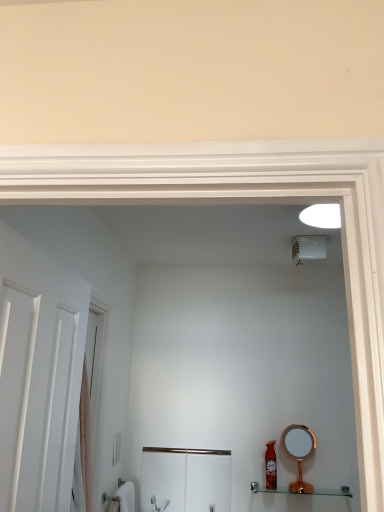
Question: Does brushed metal cabinet at lower center, acting as the first screen door starting from the right, appear on the left side of copper metallic mirror at lower right?

Choices:
 (A) no
 (B) yes

Answer: (B)

Question: Would you say brushed metal cabinet at lower center, which is counted as the first screen door, starting from the back, is outside copper metallic mirror at lower right?

Choices:
 (A) no
 (B) yes

Answer: (B)

Question: From the image's perspective, is brushed metal cabinet at lower center, placed as the 2th screen door when sorted from front to back, located beneath copper metallic mirror at lower right?

Choices:
 (A) no
 (B) yes

Answer: (B)

Question: Is brushed metal cabinet at lower center, the 2th screen door from the left, shorter than copper metallic mirror at lower right?

Choices:
 (A) no
 (B) yes

Answer: (A)

Question: Can you confirm if brushed metal cabinet at lower center, the 2th screen door when ordered from top to bottom, is positioned to the right of copper metallic mirror at lower right?

Choices:
 (A) yes
 (B) no

Answer: (B)

Question: From the image's perspective, is brushed metal cabinet at lower center, the 2th screen door from the left, on copper metallic mirror at lower right?

Choices:
 (A) yes
 (B) no

Answer: (B)

Question: Would you say white matte door at left is part of copper metallic mirror at lower right's contents?

Choices:
 (A) yes
 (B) no

Answer: (B)

Question: Is copper metallic mirror at lower right shorter than white matte door at left?

Choices:
 (A) yes
 (B) no

Answer: (A)

Question: Considering the relative sizes of copper metallic mirror at lower right and white matte door at left in the image provided, is copper metallic mirror at lower right taller than white matte door at left?

Choices:
 (A) yes
 (B) no

Answer: (B)

Question: Is copper metallic mirror at lower right smaller than white matte door at left?

Choices:
 (A) no
 (B) yes

Answer: (B)

Question: Would you say copper metallic mirror at lower right is outside white matte door at left?

Choices:
 (A) no
 (B) yes

Answer: (B)

Question: From the image's perspective, is copper metallic mirror at lower right under white matte door at left?

Choices:
 (A) yes
 (B) no

Answer: (A)

Question: Can you confirm if shiny red bottle at lower right is positioned to the right of white plastic light switch at lower left?

Choices:
 (A) no
 (B) yes

Answer: (B)